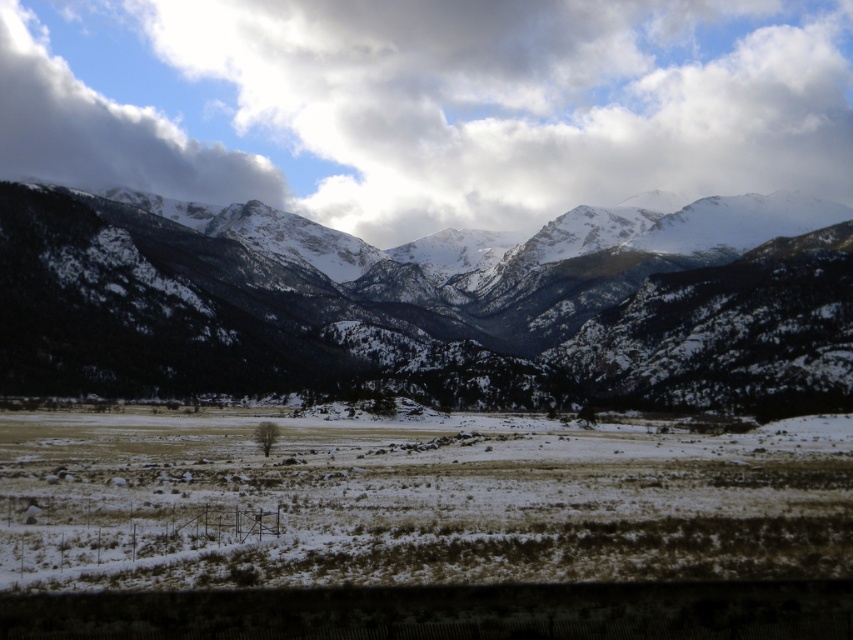
Based on the photo, you are a hiker standing on the brown dry grass at center looking towards the white fluffy cloud at upper center. Which object is higher in elevation?

The white fluffy cloud at upper center is much taller than the brown dry grass at center, so the white fluffy cloud at upper center is higher in elevation.